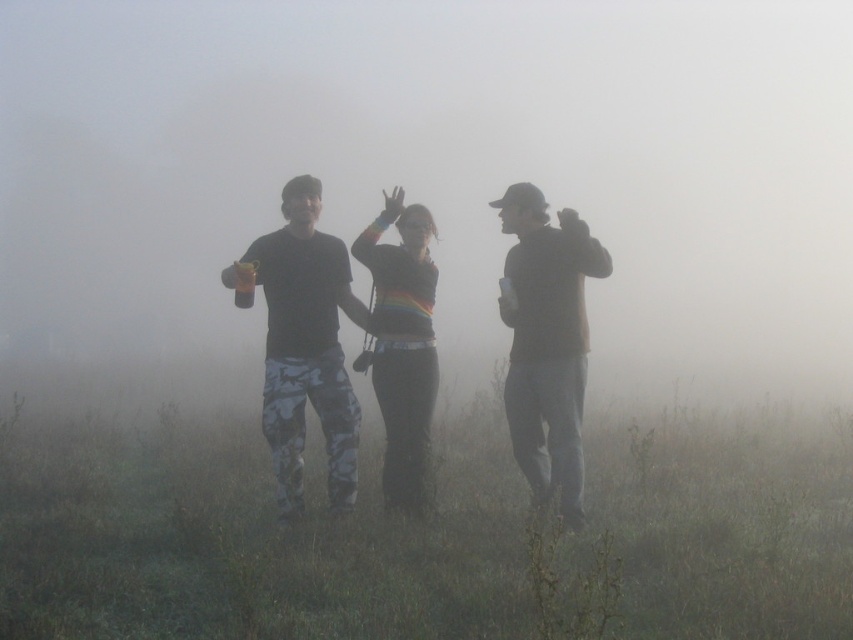
Question: Estimate the real-world distances between objects in this image. Which object is closer to the matte plastic can at center?

Choices:
 (A) matte brown sweater at right
 (B) green grass at center

Answer: (A)

Question: Is camouflage pants at center further to the viewer compared to matte brown sweater at right?

Choices:
 (A) yes
 (B) no

Answer: (A)

Question: In this image, where is green grass at center located relative to camouflage pants at center?

Choices:
 (A) below
 (B) above

Answer: (A)

Question: Which object appears closest to the camera in this image?

Choices:
 (A) green grass at center
 (B) foggy atmosphere at center
 (C) rainbow striped sweater at center
 (D) matte plastic can at center

Answer: (A)

Question: Among these points, which one is farthest from the camera?

Choices:
 (A) (241, 282)
 (B) (544, 67)
 (C) (579, 374)
 (D) (137, 422)

Answer: (B)

Question: Does foggy atmosphere at center appear over green grass at center?

Choices:
 (A) no
 (B) yes

Answer: (B)